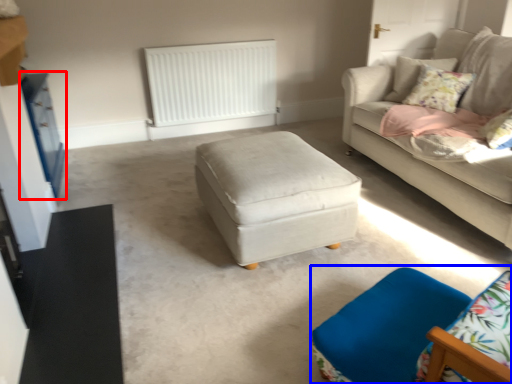
Question: Which of the following is the closest to the observer, dresser (highlighted by a red box) or swivel chair (highlighted by a blue box)?

Choices:
 (A) dresser
 (B) swivel chair

Answer: (B)